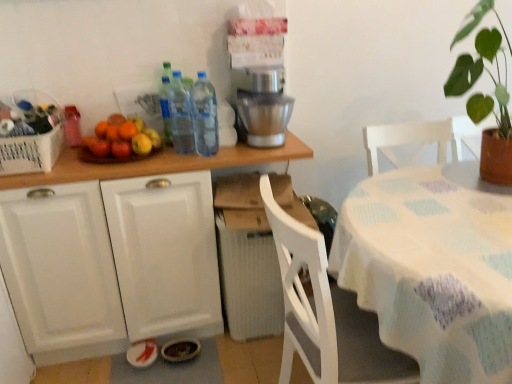
Find the location of a particular element. vacant area that is in front of satin silver coffee machine at upper center is located at coordinates (260, 151).